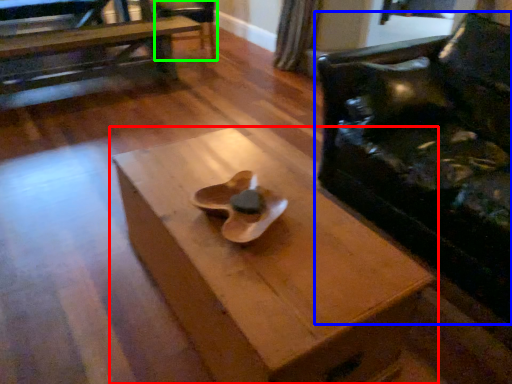
Question: Estimate the real-world distances between objects in this image. Which object is closer to table (highlighted by a red box), chair (highlighted by a blue box) or armchair (highlighted by a green box)?

Choices:
 (A) chair
 (B) armchair

Answer: (A)